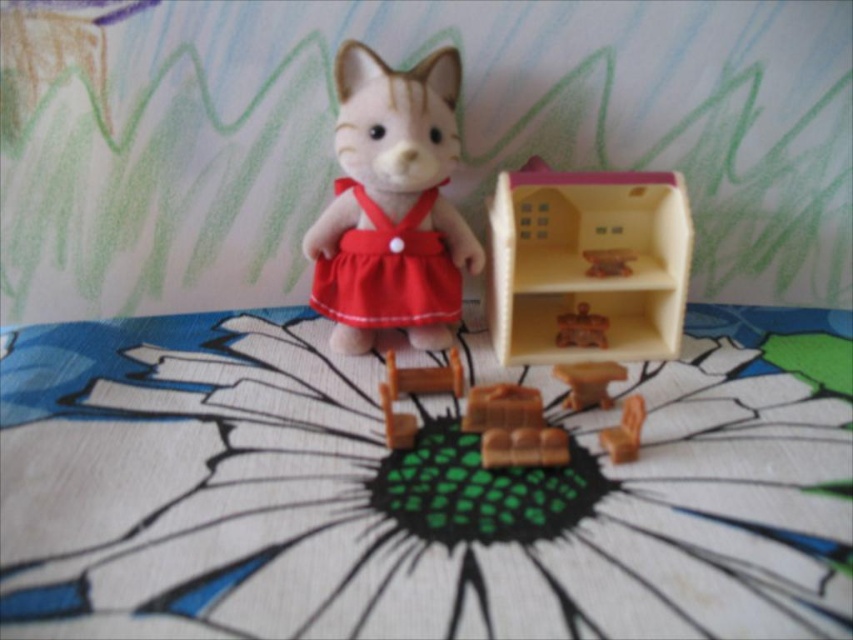
Question: Does wooden ladder at center appear on the left side of matte brown furniture at center?

Choices:
 (A) yes
 (B) no

Answer: (A)

Question: Does matte red fabric apron at center appear on the left side of wooden ladder at center?

Choices:
 (A) no
 (B) yes

Answer: (B)

Question: Based on their relative distances, which object is nearer to the matte red fabric apron at center?

Choices:
 (A) matte brown table at center
 (B) matte brown furniture at center

Answer: (A)

Question: Among these points, which one is farthest from the camera?

Choices:
 (A) (392, 417)
 (B) (610, 243)
 (C) (605, 378)
 (D) (573, 340)

Answer: (B)

Question: Is matte brown table at center further to camera compared to wooden furniture at center?

Choices:
 (A) yes
 (B) no

Answer: (B)

Question: Among these objects, which one is nearest to the camera?

Choices:
 (A) matte brown furniture at center
 (B) velvet-like red dress at center
 (C) wooden ladder at center
 (D) matte red fabric apron at center

Answer: (C)